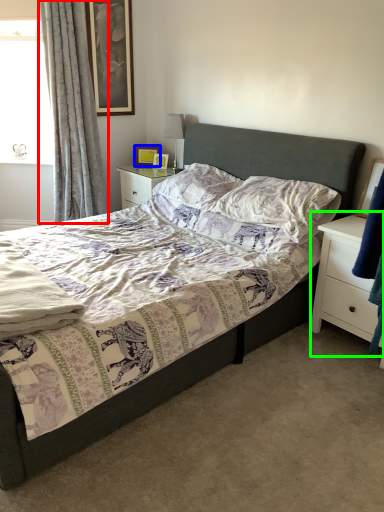
Question: Which object is the closest to the curtain (highlighted by a red box)? Choose among these: picture frame (highlighted by a blue box) or nightstand (highlighted by a green box).

Choices:
 (A) picture frame
 (B) nightstand

Answer: (A)